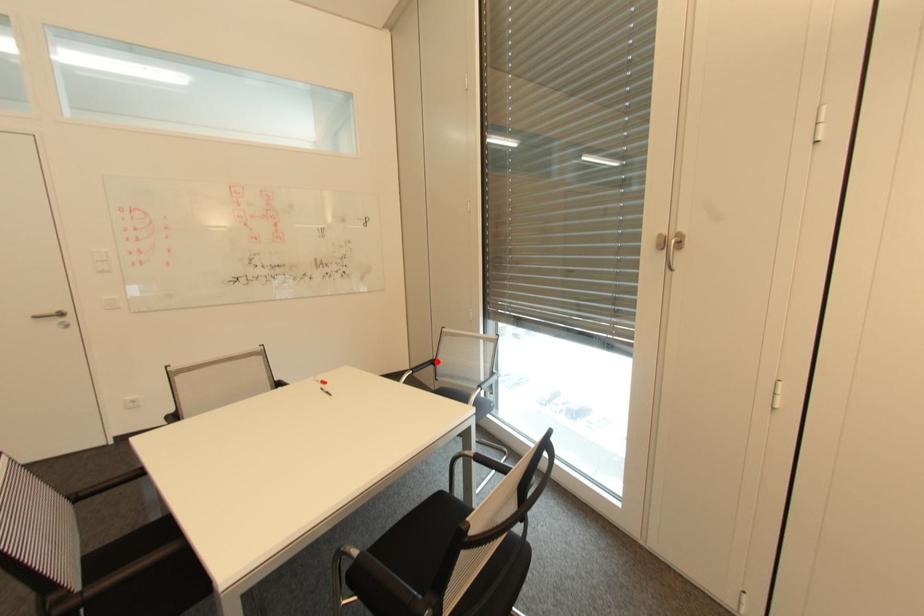
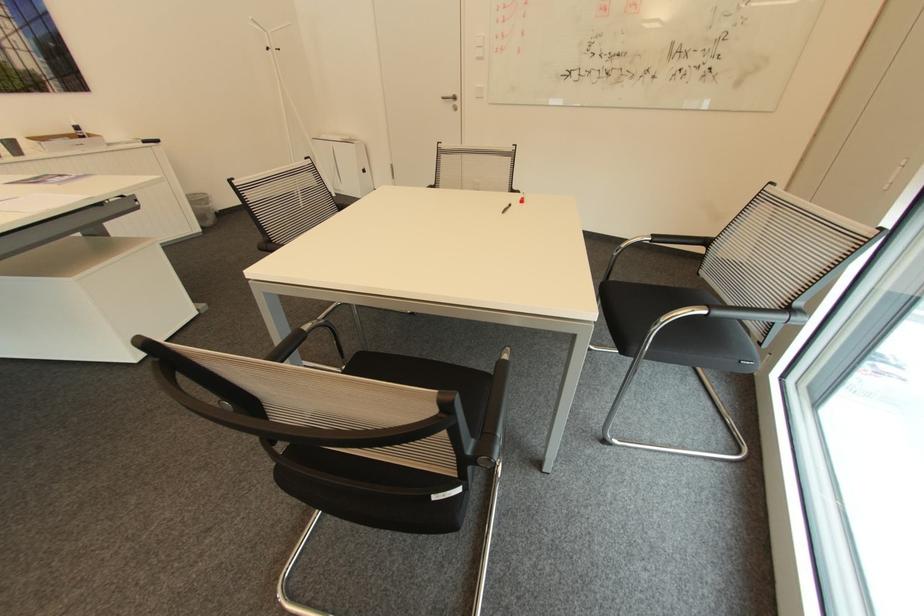
Question: I am providing you with two images of the same scene from different viewpoints. A red point is shown in image1. For the corresponding object point in image2, is it positioned nearer or farther from the camera?

Choices:
 (A) Nearer
 (B) Farther

Answer: (A)